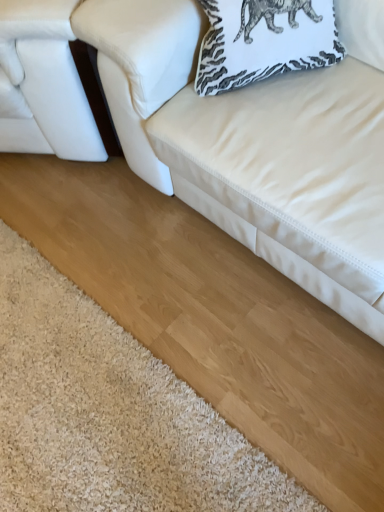
Question: From the image's perspective, is white printed pillow at upper right over white leather couch at upper right, the 1th studio couch viewed from the right?

Choices:
 (A) yes
 (B) no

Answer: (A)

Question: From the image's perspective, does white printed pillow at upper right appear lower than white leather couch at upper right, which is the 2th studio couch in left-to-right order?

Choices:
 (A) yes
 (B) no

Answer: (B)

Question: Is white printed pillow at upper right placed right next to white leather couch at upper right, which is the 2th studio couch in left-to-right order?

Choices:
 (A) no
 (B) yes

Answer: (A)

Question: From a real-world perspective, is white printed pillow at upper right physically below white leather couch at upper right, which is the 2th studio couch in left-to-right order?

Choices:
 (A) yes
 (B) no

Answer: (B)

Question: Does white printed pillow at upper right appear on the right side of white leather couch at upper right, which is the 2th studio couch in left-to-right order?

Choices:
 (A) no
 (B) yes

Answer: (A)

Question: Is white shaggy rug at lower left inside the boundaries of white leather studio couch at left, which appears as the 2th studio couch when viewed from the right, or outside?

Choices:
 (A) inside
 (B) outside

Answer: (B)

Question: From their relative heights in the image, would you say white shaggy rug at lower left is taller or shorter than white leather studio couch at left, which appears as the 2th studio couch when viewed from the right?

Choices:
 (A) tall
 (B) short

Answer: (B)

Question: In the image, is white shaggy rug at lower left positioned in front of or behind white leather studio couch at left, which appears as the 2th studio couch when viewed from the right?

Choices:
 (A) front
 (B) behind

Answer: (A)

Question: Visually, is white shaggy rug at lower left positioned to the left or to the right of white leather studio couch at left, which is the first studio couch from left to right?

Choices:
 (A) left
 (B) right

Answer: (B)

Question: Is white shaggy rug at lower left inside the boundaries of white printed pillow at upper right, or outside?

Choices:
 (A) outside
 (B) inside

Answer: (A)

Question: From a real-world perspective, is white shaggy rug at lower left above or below white printed pillow at upper right?

Choices:
 (A) above
 (B) below

Answer: (B)

Question: Does point (135, 343) appear closer or farther from the camera than point (241, 31)?

Choices:
 (A) closer
 (B) farther

Answer: (B)

Question: In terms of height, does white shaggy rug at lower left look taller or shorter compared to white printed pillow at upper right?

Choices:
 (A) tall
 (B) short

Answer: (B)

Question: Is white printed pillow at upper right to the left or to the right of white leather studio couch at left, which appears as the 2th studio couch when viewed from the right, in the image?

Choices:
 (A) left
 (B) right

Answer: (B)

Question: From a real-world perspective, relative to white leather studio couch at left, which appears as the 2th studio couch when viewed from the right, is white printed pillow at upper right vertically above or below?

Choices:
 (A) above
 (B) below

Answer: (A)